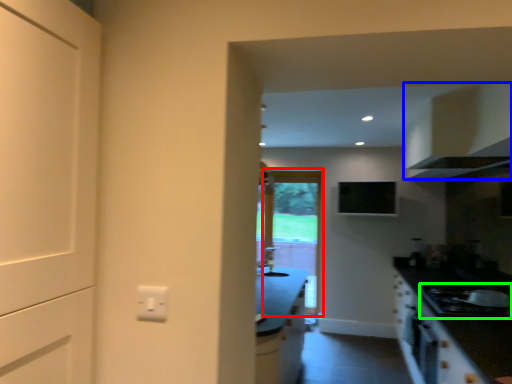
Question: Which is nearer to the screen door (highlighted by a red box)? cabinetry (highlighted by a blue box) or gas stove (highlighted by a green box).

Choices:
 (A) cabinetry
 (B) gas stove

Answer: (A)